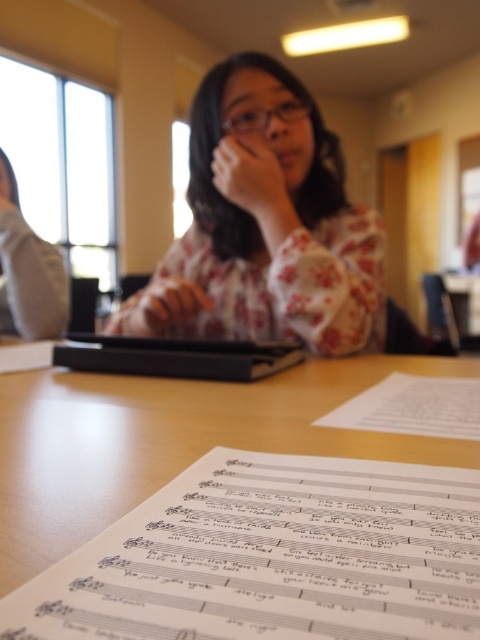
Does wooden table at center appear over floral fabric shirt at center?

Actually, wooden table at center is below floral fabric shirt at center.

Who is more forward, [277,611] or [265,138]?

Result: Point [277,611] is more forward.

Between point (276, 522) and point (212, 124), which one is positioned behind?

Positioned behind is point (212, 124).

Image resolution: width=480 pixels, height=640 pixels. Identify the location of wooden table at center. (249, 536).

Which is behind, point (27, 243) or point (360, 426)?

The point (27, 243) is more distant.

Which is more to the left, gray fabric shirt at left or white paper at center?

Positioned to the left is gray fabric shirt at left.

You are a GUI agent. You are given a task and a screenshot of the screen. Output one action in this format:
    pyautogui.click(x=<x>, y=<y>)
    Task: Click on the gray fabric shirt at left
    This screenshot has height=640, width=480.
    Given the screenshot: What is the action you would take?
    pyautogui.click(x=27, y=272)

The image size is (480, 640). In order to click on gray fabric shirt at left in this screenshot , I will do `click(27, 272)`.

Between point (287, 179) and point (43, 285), which one is positioned in front?

Positioned in front is point (287, 179).

Is point (354, 296) positioned before point (10, 304)?

Yes, point (354, 296) is closer to viewer.

The height and width of the screenshot is (640, 480). I want to click on floral fabric shirt at center, so click(x=265, y=227).